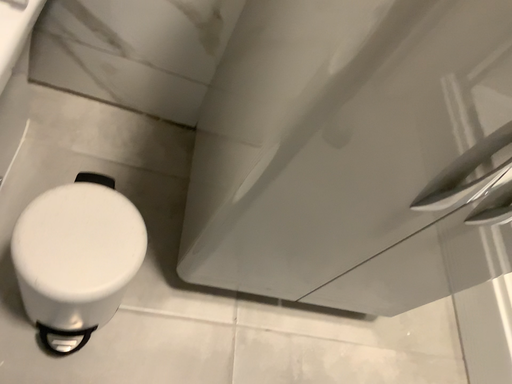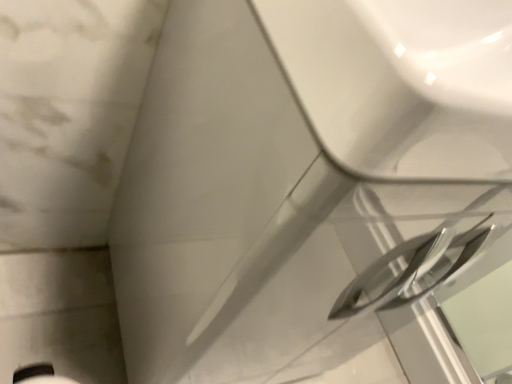
Question: Which way did the camera rotate in the video?

Choices:
 (A) rotated left
 (B) rotated right

Answer: (B)